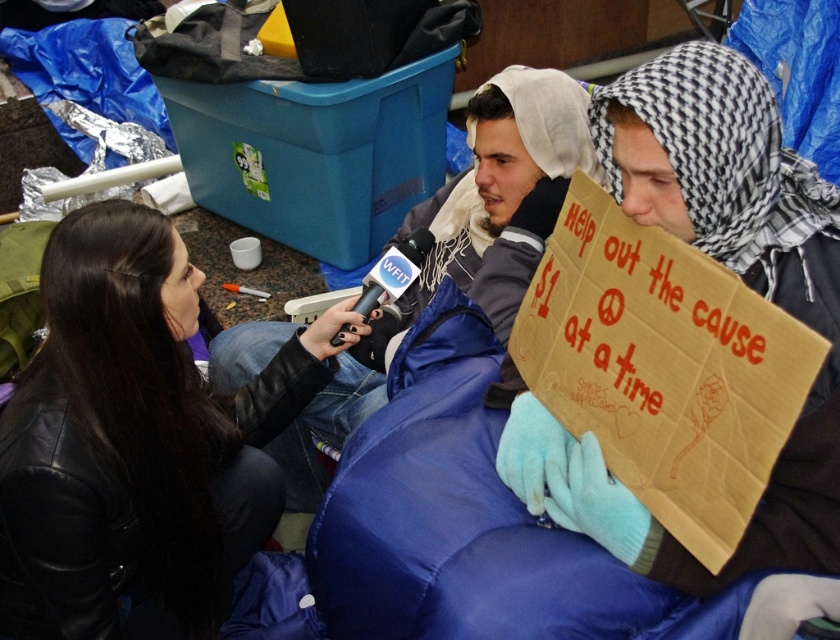
Question: Can you confirm if black leather jacket at lower left is wider than blue puffy jacket at center?

Choices:
 (A) yes
 (B) no

Answer: (B)

Question: Which object is closer to the camera taking this photo?

Choices:
 (A) blue puffy jacket at center
 (B) black leather jacket at lower left

Answer: (B)

Question: Observing the image, what is the correct spatial positioning of black leather jacket at lower left in reference to blue puffy jacket at center?

Choices:
 (A) above
 (B) below

Answer: (B)

Question: Which of the following is the farthest from the observer?

Choices:
 (A) black leather jacket at lower left
 (B) blue puffy jacket at center

Answer: (B)

Question: Can you confirm if black leather jacket at lower left is positioned below blue puffy jacket at center?

Choices:
 (A) no
 (B) yes

Answer: (B)